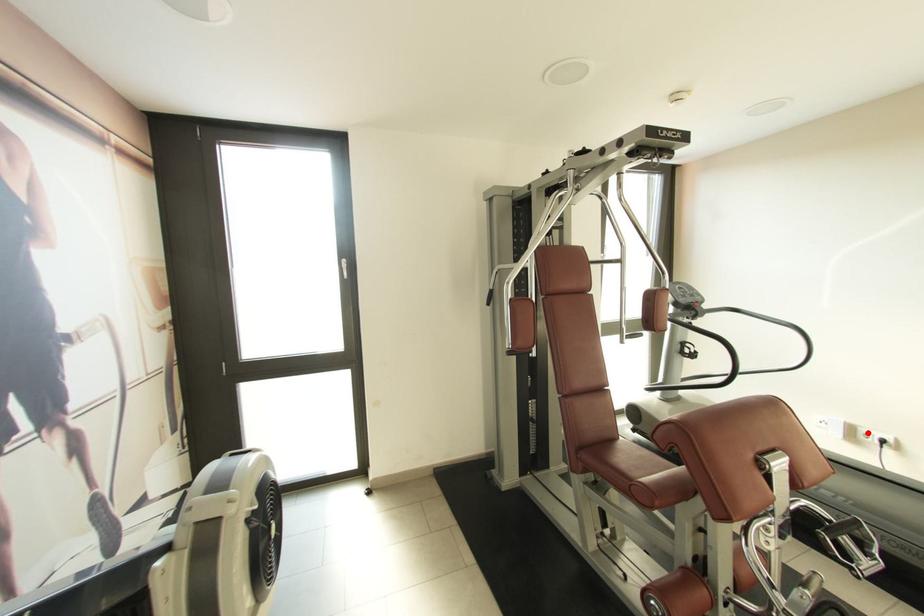
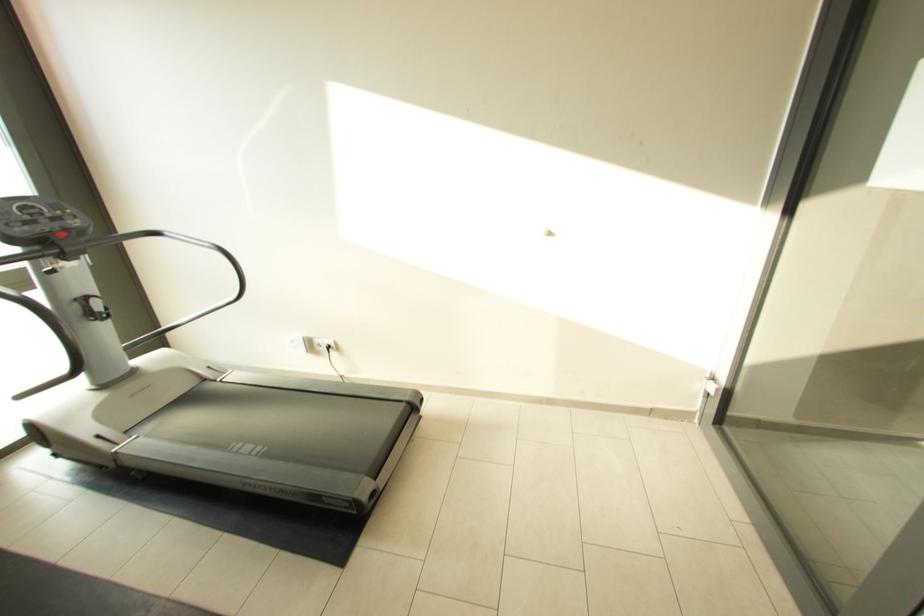
Where in the second image is the point corresponding to the highlighted location from the first image?

(322, 342)